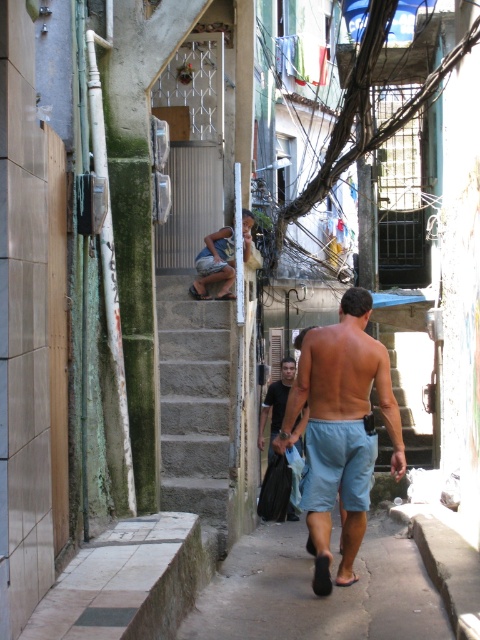
You are a delivery person trying to navigate through the narrow alleyway. You need to pass by the light blue cotton shorts at center and the gray concrete stairs at center. Given their widths, which one might require you to adjust your path more?

The light blue cotton shorts at center has a larger width than the gray concrete stairs at center, so you would need to adjust your path more around the light blue cotton shorts at center.

You are a delivery person carrying a package that is as wide as the light blue denim shorts at center. You need to walk up the gray concrete stairs at center. Will the package fit through the stairs?

The gray concrete stairs at center are wider than the light blue denim shorts at center, so the package, which is as wide as the light blue denim shorts at center, will fit through the stairs.

You are a delivery person trying to navigate through the narrow alley. You see the gray concrete stairs at center and the light blue denim shorts at center. Which object is located to the left when facing the direction the man is walking?

The gray concrete stairs at center is positioned on the left side of light blue denim shorts at center, so when facing the direction the man is walking, the gray concrete stairs at center would be on the left side.